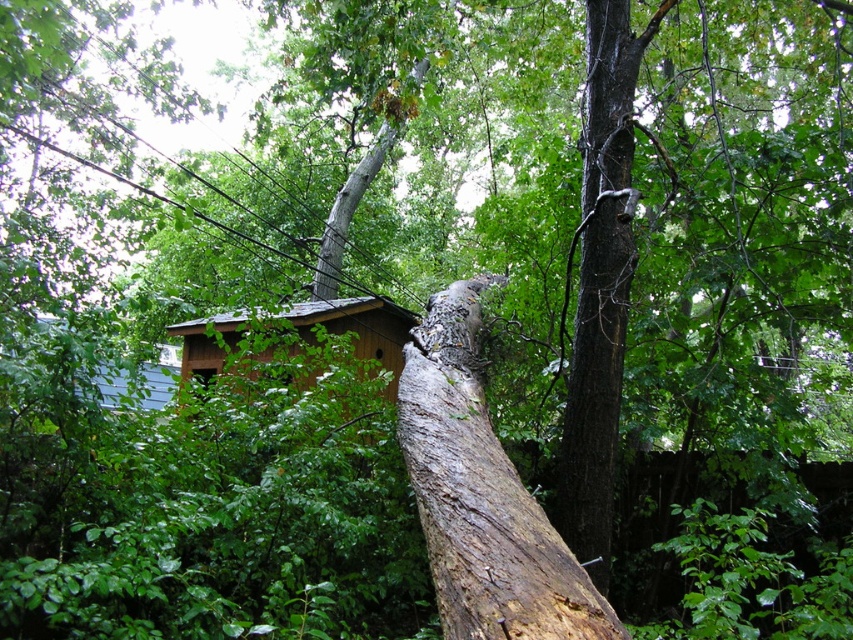
Does brown rough tree trunk at center appear on the left side of brown rough bark at center?

Indeed, brown rough tree trunk at center is positioned on the left side of brown rough bark at center.

Between brown rough tree trunk at center and brown rough bark at center, which one appears on the right side from the viewer's perspective?

Positioned to the right is brown rough bark at center.

Is point (498, 547) in front of point (604, 166)?

Yes, point (498, 547) is in front of point (604, 166).

Locate an element on the screen. brown rough tree trunk at center is located at coordinates pos(482,496).

Between brown rough tree trunk at center and brown wooden hut at center, which one is positioned higher?

brown wooden hut at center is higher up.

Is point (549, 624) positioned in front of point (311, 372)?

That is True.

Locate an element on the screen. The width and height of the screenshot is (853, 640). brown rough tree trunk at center is located at coordinates (482, 496).

Is brown rough bark at center to the right of brown wooden hut at center from the viewer's perspective?

Correct, you'll find brown rough bark at center to the right of brown wooden hut at center.

Who is positioned more to the left, brown rough bark at center or brown wooden hut at center?

brown wooden hut at center is more to the left.

Locate an element on the screen. Image resolution: width=853 pixels, height=640 pixels. brown rough bark at center is located at coordinates (601, 284).

Find the location of a particular element. brown rough bark at center is located at coordinates (601, 284).